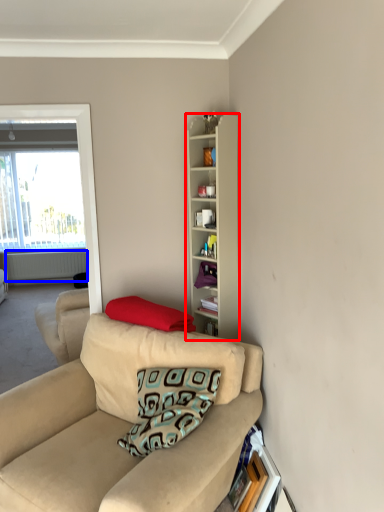
Question: Among these objects, which one is nearest to the camera, cabinetry (highlighted by a red box) or radiator (highlighted by a blue box)?

Choices:
 (A) cabinetry
 (B) radiator

Answer: (A)